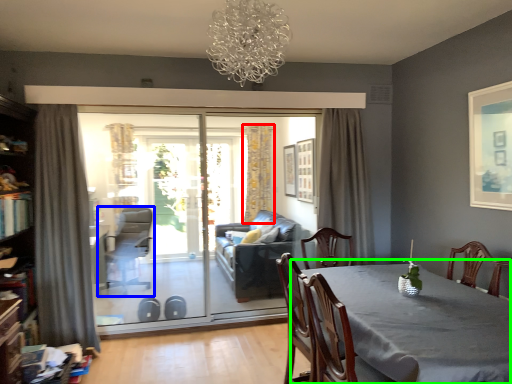
Question: Based on their relative distances, which object is farther from curtain (highlighted by a red box)? Choose from swivel chair (highlighted by a blue box) and table (highlighted by a green box).

Choices:
 (A) swivel chair
 (B) table

Answer: (B)